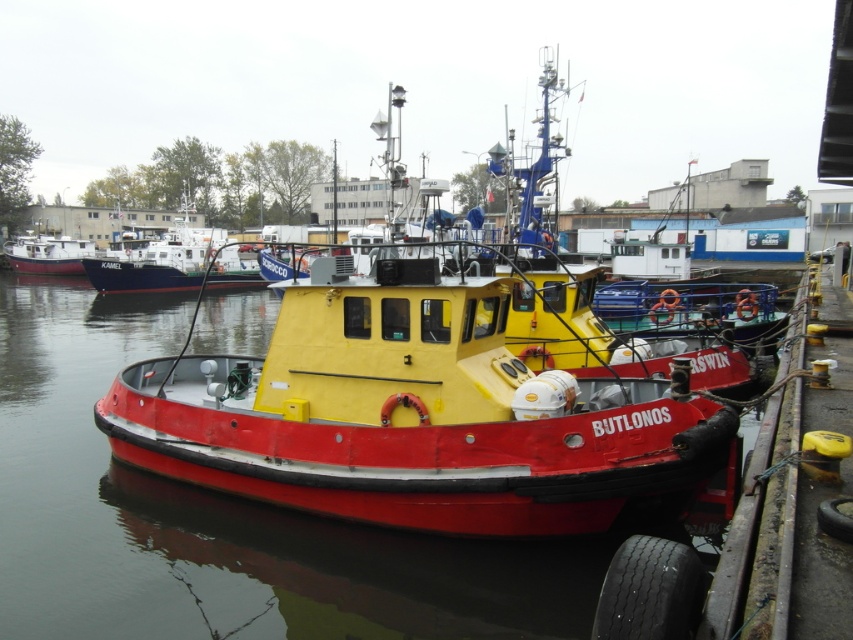
Question: Among these objects, which one is nearest to the camera?

Choices:
 (A) red matte tugboat at center
 (B) red matte water at center

Answer: (B)

Question: Which object appears farthest from the camera in this image?

Choices:
 (A) red matte water at center
 (B) red matte boat at left
 (C) red matte tugboat at center

Answer: (B)

Question: Considering the relative positions of matte white boat at upper left and red matte boat at left in the image provided, where is matte white boat at upper left located with respect to red matte boat at left?

Choices:
 (A) above
 (B) below

Answer: (B)

Question: Is red matte tugboat at center smaller than red matte water at center?

Choices:
 (A) yes
 (B) no

Answer: (A)

Question: Is matte white boat at upper left wider than red matte boat at left?

Choices:
 (A) yes
 (B) no

Answer: (B)

Question: Which of the following is the closest to the observer?

Choices:
 (A) red matte water at center
 (B) matte white boat at upper left
 (C) red matte tugboat at center
 (D) red matte boat at left

Answer: (A)